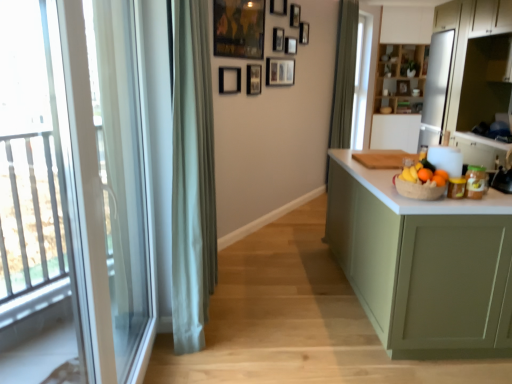
Question: Looking at the image, does green matte cabinet at right, which is counted as the 1th cabinetry, starting from the left, seem bigger or smaller compared to wooden picture frame at upper center, the 1th picture frame viewed from the back?

Choices:
 (A) small
 (B) big

Answer: (B)

Question: Is point (334, 160) closer or farther from the camera than point (404, 92)?

Choices:
 (A) closer
 (B) farther

Answer: (A)

Question: Based on their relative distances, which object is nearer to the orange matte at right, the 1th orange when ordered from right to left?

Choices:
 (A) green matte cabinet at right, which is counted as the 1th cabinetry, starting from the left
 (B) black matte picture frame at upper center, placed as the second picture frame when sorted from front to back
 (C) matte black picture frame at upper center, the 5th picture frame positioned from the front
 (D) wooden picture frame at upper center, the 1th picture frame viewed from the back
 (E) transparent glass screen door at left

Answer: (A)

Question: Based on their relative distances, which object is farther from the wooden picture frame at upper center, which is the fifth picture frame from left to right?

Choices:
 (A) matte black picture frame at upper center, marked as the fourth picture frame in a front-to-back arrangement
 (B) orange matte at right, which is the 2th orange in left-to-right order
 (C) wooden picture frame at upper center, placed as the tenth picture frame when sorted from back to front
 (D) green matte cabinet at right, positioned as the 1th cabinetry in front-to-back order
 (E) matte black picture frame at upper center, which is the third picture frame from front to back

Answer: (B)